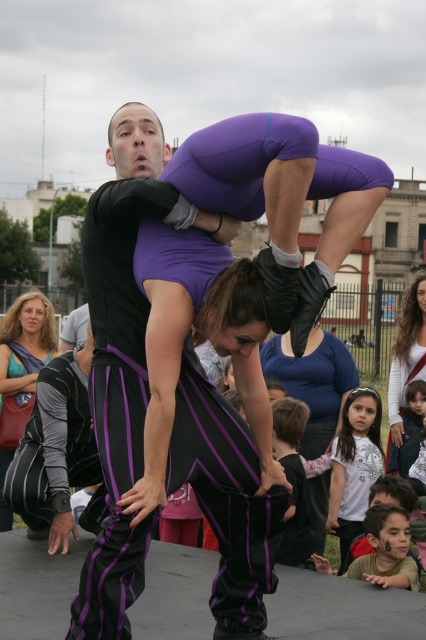
Question: Does matte purple pants at center have a smaller size compared to white cotton shirt at center?

Choices:
 (A) yes
 (B) no

Answer: (A)

Question: Does matte black pants at center have a larger size compared to white cotton shirt at center?

Choices:
 (A) yes
 (B) no

Answer: (A)

Question: Where is matte black pants at lower left located in relation to white cotton shirt at center in the image?

Choices:
 (A) right
 (B) left

Answer: (B)

Question: Which of the following is the closest to the observer?

Choices:
 (A) matte black pants at lower left
 (B) matte black pants at center
 (C) matte purple pants at center

Answer: (B)

Question: Which point appears farthest from the camera in this image?

Choices:
 (A) (417, 365)
 (B) (65, 525)
 (C) (235, 225)
 (D) (37, 312)

Answer: (A)

Question: Estimate the real-world distances between objects in this image. Which object is closer to the matte purple pants at center?

Choices:
 (A) matte black pants at center
 (B) white cotton shirt at center
 (C) matte black pants at lower left

Answer: (C)